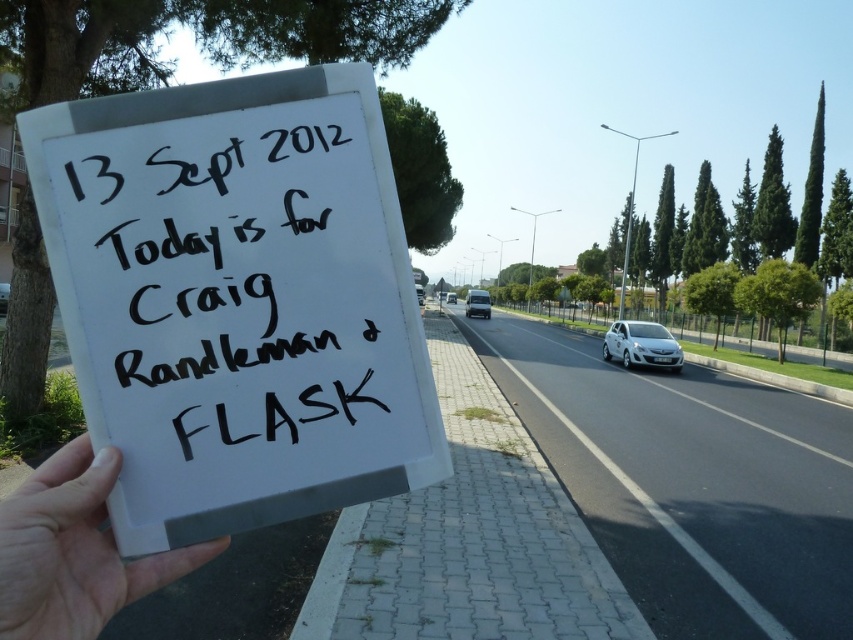
Question: Can you confirm if white plastic sign at center is positioned below white matte van at center?

Choices:
 (A) no
 (B) yes

Answer: (B)

Question: In this image, where is white plastic sign at lower left located relative to white metallic car at right?

Choices:
 (A) right
 (B) left

Answer: (B)

Question: Which point is farther to the camera?

Choices:
 (A) (222, 209)
 (B) (61, 596)
 (C) (418, 300)

Answer: (C)

Question: Which object is farther from the camera taking this photo?

Choices:
 (A) white plastic sign at lower left
 (B) white matte van at center
 (C) white plastic van at center

Answer: (C)

Question: Which point is closer to the camera taking this photo?

Choices:
 (A) (175, 561)
 (B) (418, 298)
 (C) (39, 136)
 (D) (639, 323)

Answer: (A)

Question: Can you confirm if white matte van at center is wider than white glossy car at center?

Choices:
 (A) yes
 (B) no

Answer: (B)